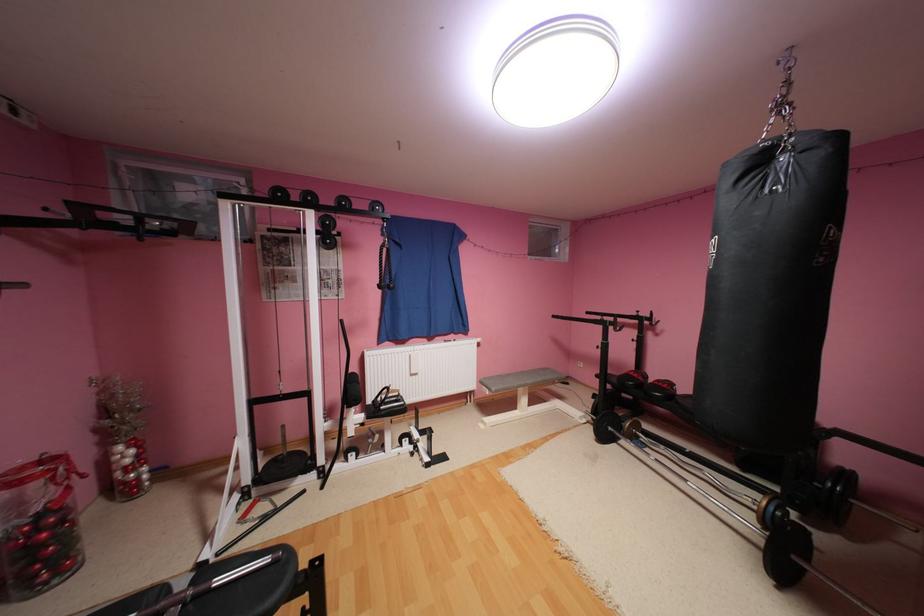
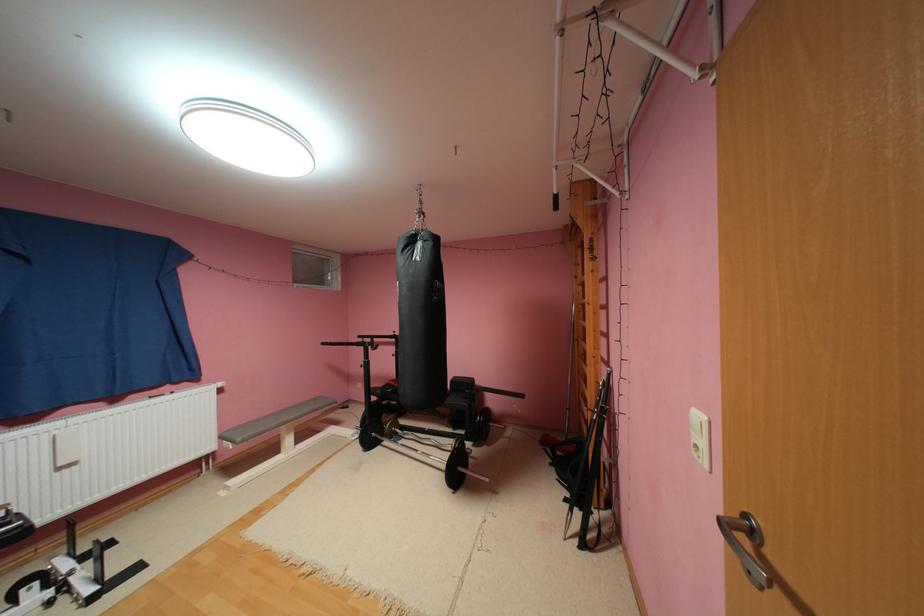
Where in the second image is the point corresponding to pixel 593 419 from the first image?

(366, 436)